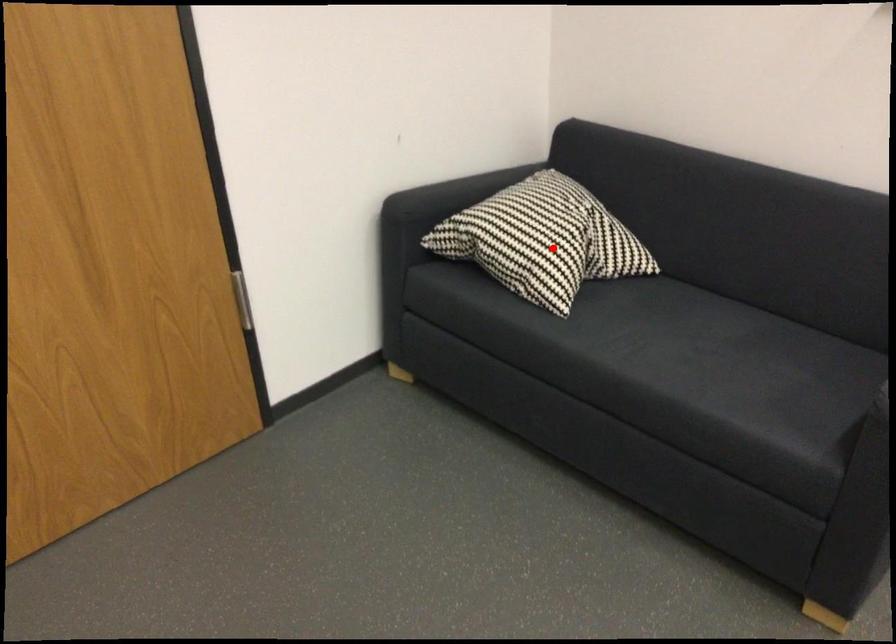
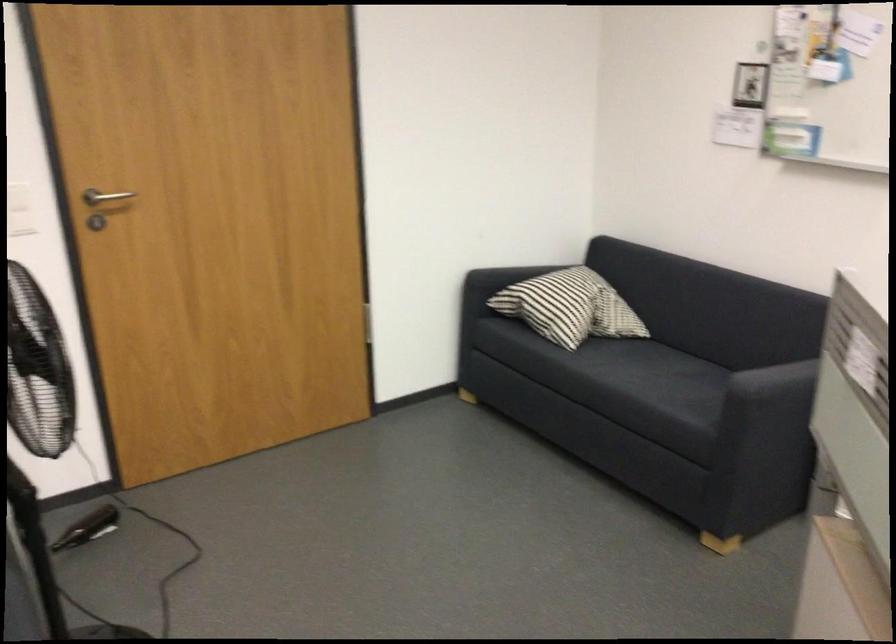
Question: I am providing you with two images of the same scene from different viewpoints. A red point is shown in image1. For the corresponding object point in image2, is it positioned nearer or farther from the camera?

Choices:
 (A) Nearer
 (B) Farther

Answer: (B)